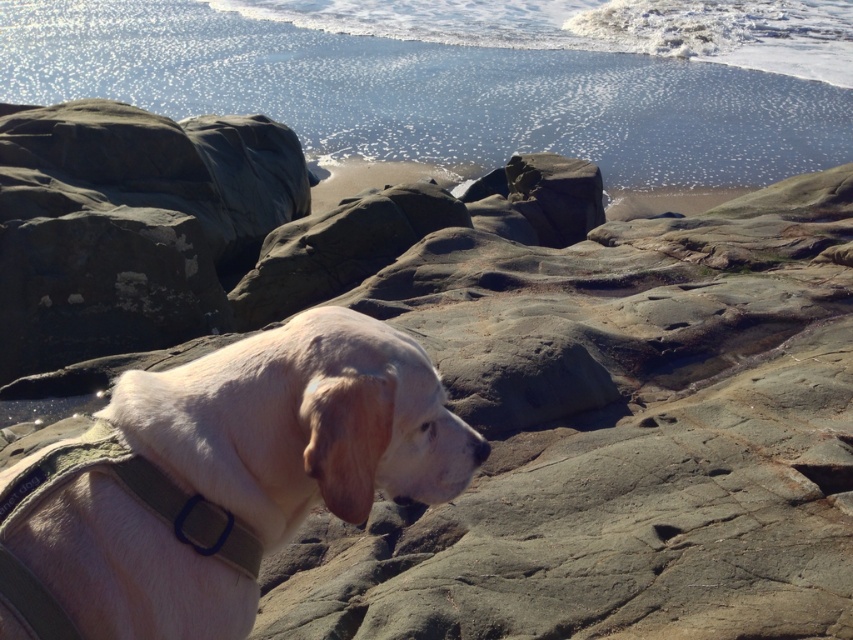
From the picture: You are a photographer trying to capture the light beige fur at center and the shiny blue water at upper center in a single shot. Based on their positions, which object should you adjust your camera to focus on first if you want to ensure both are in frame?

The light beige fur at center is to the left of the shiny blue water at upper center, so you should focus on the shiny blue water at upper center first to ensure both are in frame.

You are standing on the rocky terrain where the lightcolored dog with a green harness is located. You want to walk directly towards the shiny blue water at upper center. Which direction should you head relative to your current position?

The shiny blue water at upper center is located at point (473, 76), so you should head towards the upper center direction from your current position on the rocky terrain.